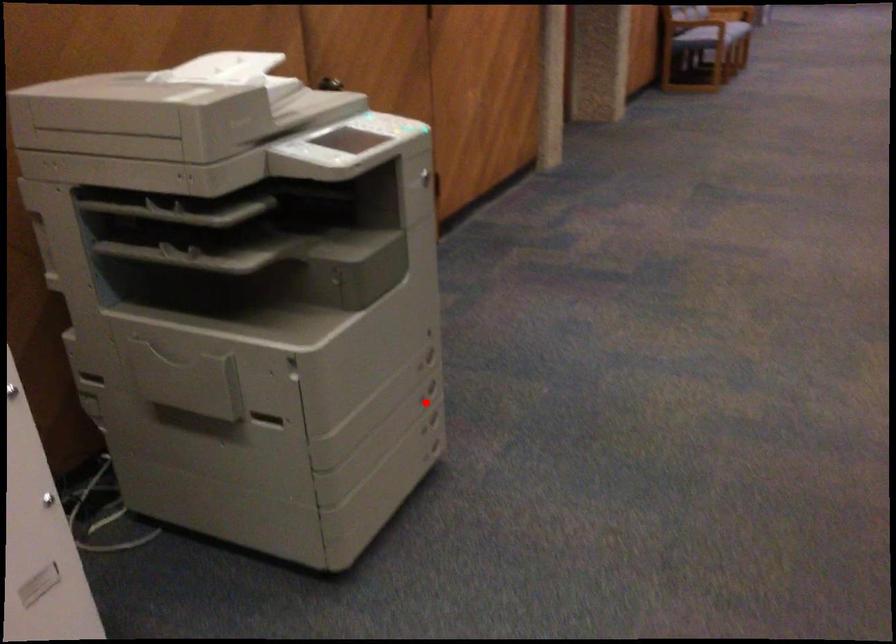
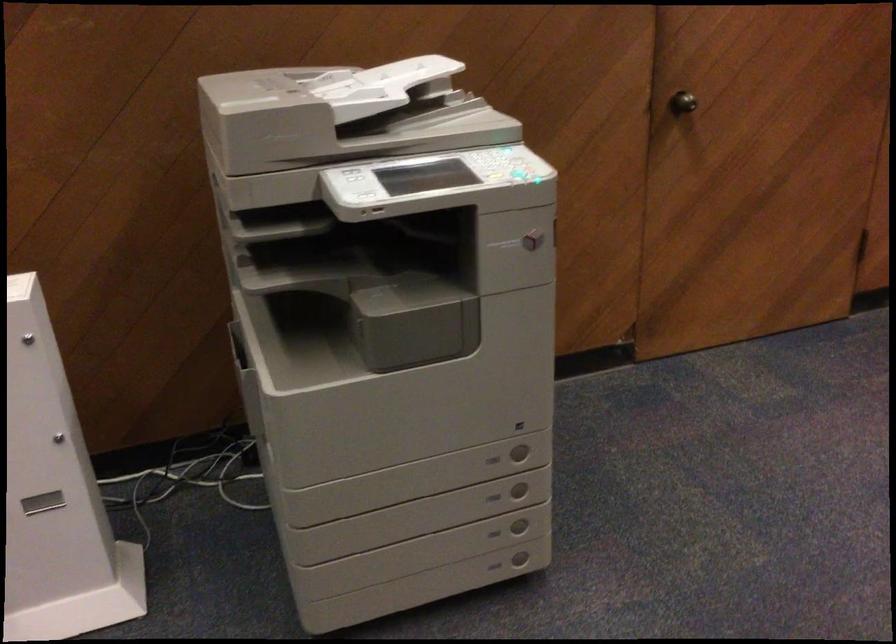
Question: I am providing you with two images of the same scene from different viewpoints. Given a red point in image1, look at the same physical point in image2. Is it:

Choices:
 (A) Closer to the viewpoint
 (B) Farther from the viewpoint

Answer: (A)